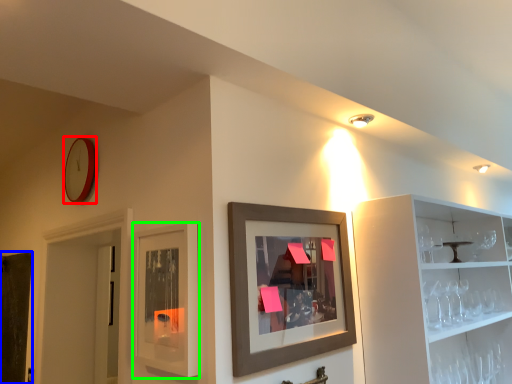
Question: Which object is the closest to the clock (highlighted by a red box)? Choose among these: door (highlighted by a blue box) or cabinet (highlighted by a green box).

Choices:
 (A) door
 (B) cabinet

Answer: (B)